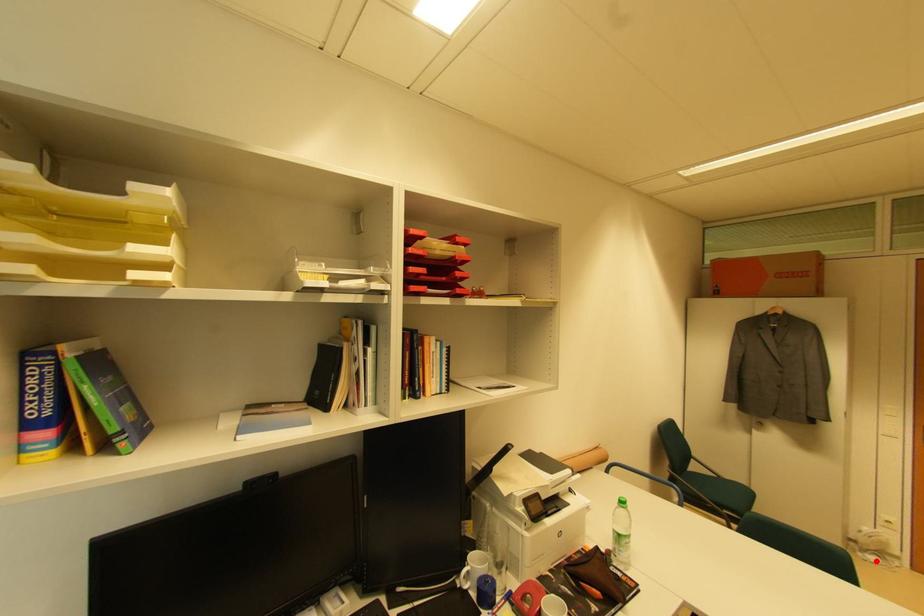
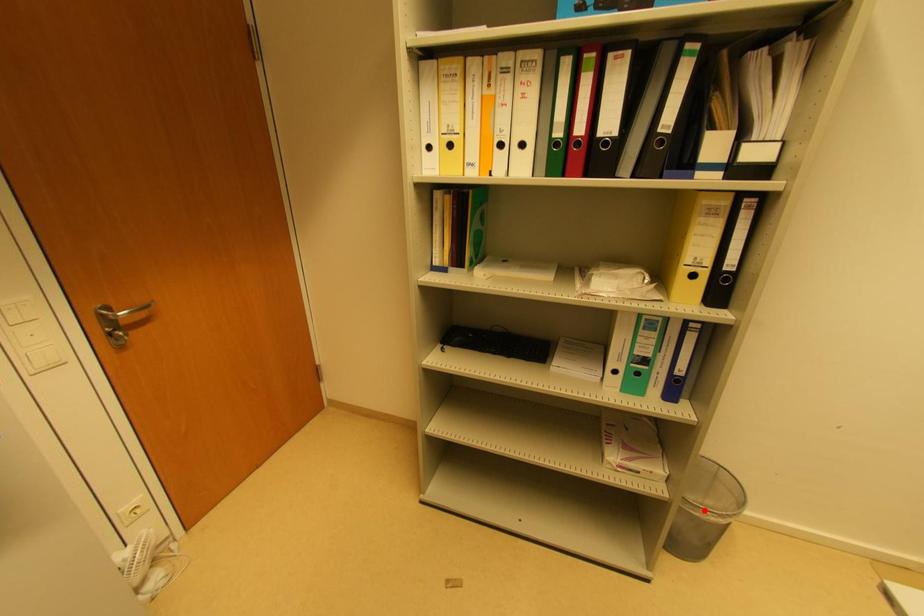
I am providing you with two images of the same scene from different viewpoints. A red point is marked on the first image and another point is marked on the second image. Is the red point in image1 aligned with the point shown in image2?

No